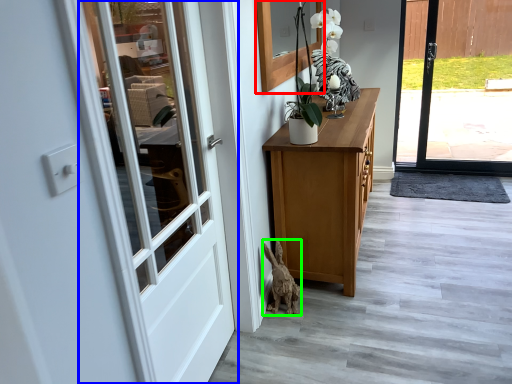
Question: Estimate the real-world distances between objects in this image. Which object is closer to window (highlighted by a red box), door (highlighted by a blue box) or animal (highlighted by a green box)?

Choices:
 (A) door
 (B) animal

Answer: (A)